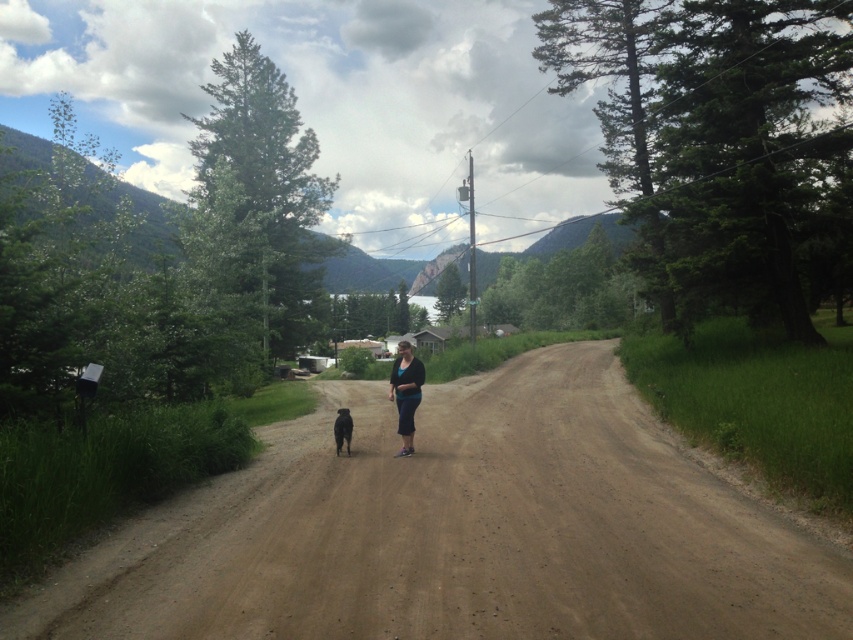
Question: Is brown dirt track at center further to camera compared to matte black pants at center?

Choices:
 (A) no
 (B) yes

Answer: (A)

Question: Does matte black pants at center come behind black fur dog at center?

Choices:
 (A) yes
 (B) no

Answer: (B)

Question: Estimate the real-world distances between objects in this image. Which object is farther from the matte black pants at center?

Choices:
 (A) black fur dog at center
 (B) brown dirt track at center

Answer: (B)

Question: Does matte black pants at center have a larger size compared to black fur dog at center?

Choices:
 (A) yes
 (B) no

Answer: (A)

Question: Which object is positioned farthest from the black fur dog at center?

Choices:
 (A) matte black pants at center
 (B) brown dirt track at center

Answer: (B)

Question: Estimate the real-world distances between objects in this image. Which object is closer to the matte black pants at center?

Choices:
 (A) black fur dog at center
 (B) brown dirt track at center

Answer: (A)